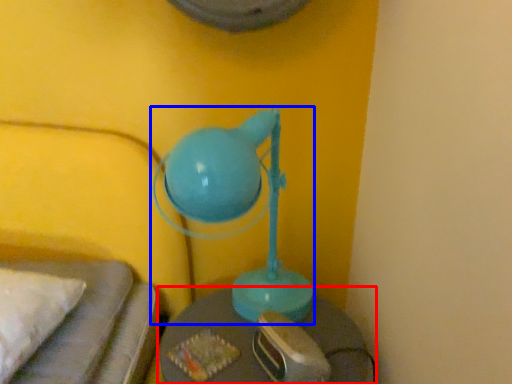
Question: Which object is further to the camera taking this photo, table (highlighted by a red box) or lamp (highlighted by a blue box)?

Choices:
 (A) table
 (B) lamp

Answer: (A)